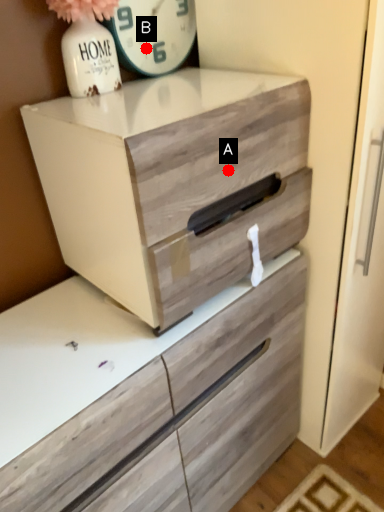
Question: Two points are circled on the image, labeled by A and B beside each circle. Which point is closer to the camera taking this photo?

Choices:
 (A) A is closer
 (B) B is closer

Answer: (A)